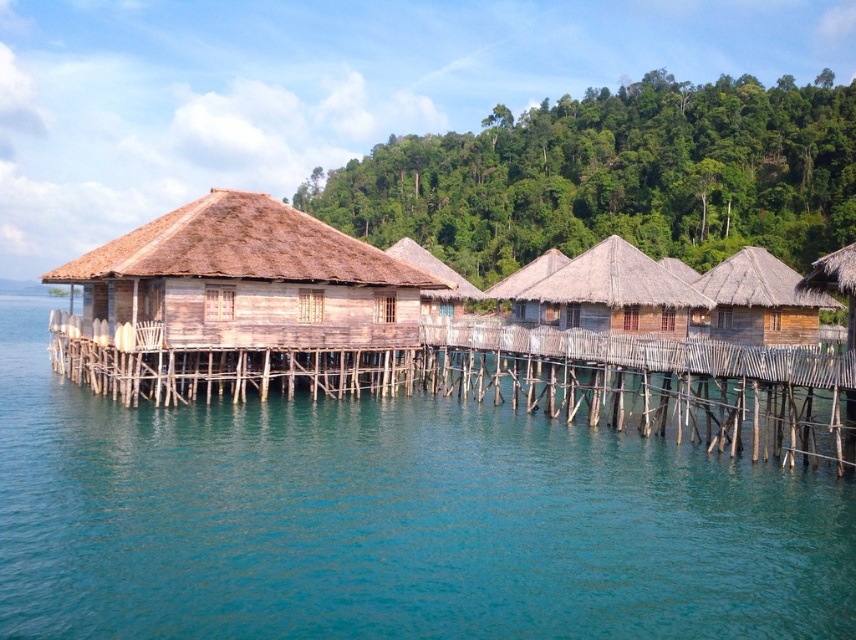
Does wooden dock at center have a lesser width compared to wooden thatched hut at right?

No, wooden dock at center is not thinner than wooden thatched hut at right.

Who is taller, wooden dock at center or wooden thatched hut at right?

wooden thatched hut at right is taller.

What do you see at coordinates (520, 381) in the screenshot? This screenshot has height=640, width=856. I see `wooden dock at center` at bounding box center [520, 381].

You are a GUI agent. You are given a task and a screenshot of the screen. Output one action in this format:
    pyautogui.click(x=<x>, y=<y>)
    Task: Click on the wooden dock at center
    This screenshot has height=640, width=856.
    Given the screenshot: What is the action you would take?
    pyautogui.click(x=520, y=381)

Who is shorter, wooden dock at center or wooden hut at center?

wooden dock at center is shorter.

Is wooden dock at center to the right of wooden hut at center from the viewer's perspective?

Yes, wooden dock at center is to the right of wooden hut at center.

Is point (395, 365) positioned in front of point (351, 321)?

No, it is not.

Find the location of a particular element. The width and height of the screenshot is (856, 640). wooden dock at center is located at coordinates click(x=520, y=381).

Between point (687, 298) and point (794, 276), which one is positioned behind?

The point (794, 276) is more distant.

Does brown thatch hut at center appear on the left side of brown wooden hut at right?

Yes, brown thatch hut at center is to the left of brown wooden hut at right.

You are a GUI agent. You are given a task and a screenshot of the screen. Output one action in this format:
    pyautogui.click(x=<x>, y=<y>)
    Task: Click on the brown thatch hut at center
    The image size is (856, 640).
    Given the screenshot: What is the action you would take?
    pyautogui.click(x=615, y=292)

What are the coordinates of `brown thatch hut at center` in the screenshot? It's located at (615, 292).